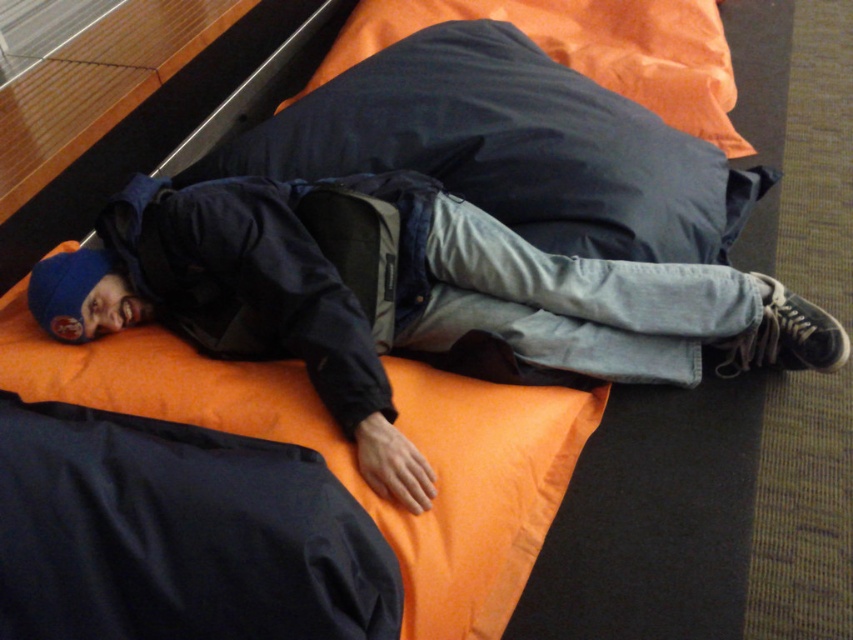
Does dark blue matte jacket at center appear over dark blue fabric pillow at upper center?

No.

Is dark blue matte jacket at center thinner than dark blue fabric pillow at upper center?

Yes.

What do you see at coordinates (270, 275) in the screenshot?
I see `dark blue matte jacket at center` at bounding box center [270, 275].

Image resolution: width=853 pixels, height=640 pixels. I want to click on dark blue matte jacket at center, so click(x=270, y=275).